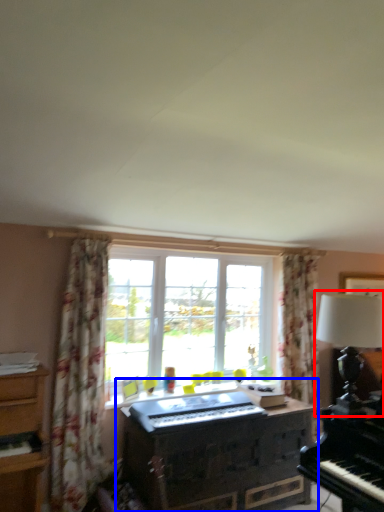
Question: Which of the following is the closest to the observer, table lamp (highlighted by a red box) or dresser (highlighted by a blue box)?

Choices:
 (A) table lamp
 (B) dresser

Answer: (A)